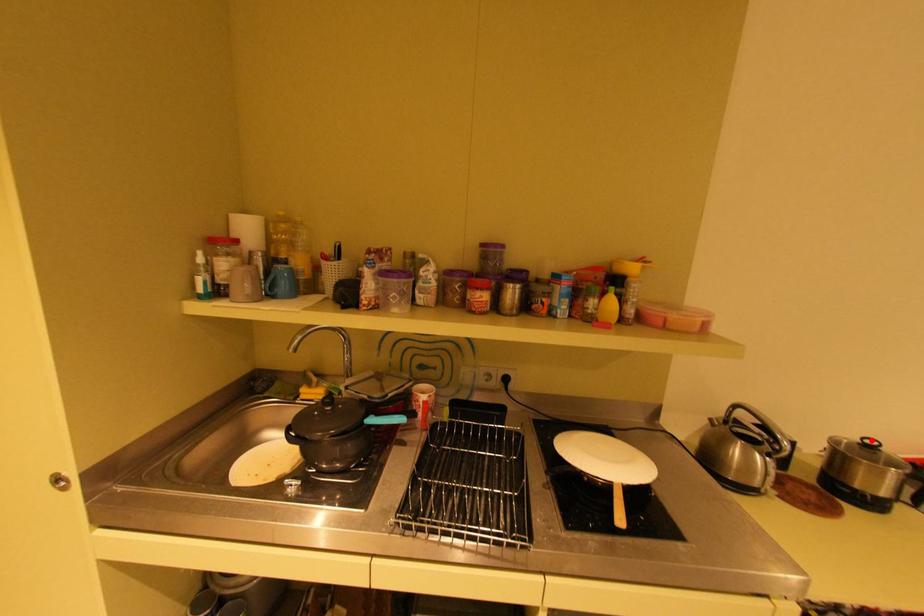
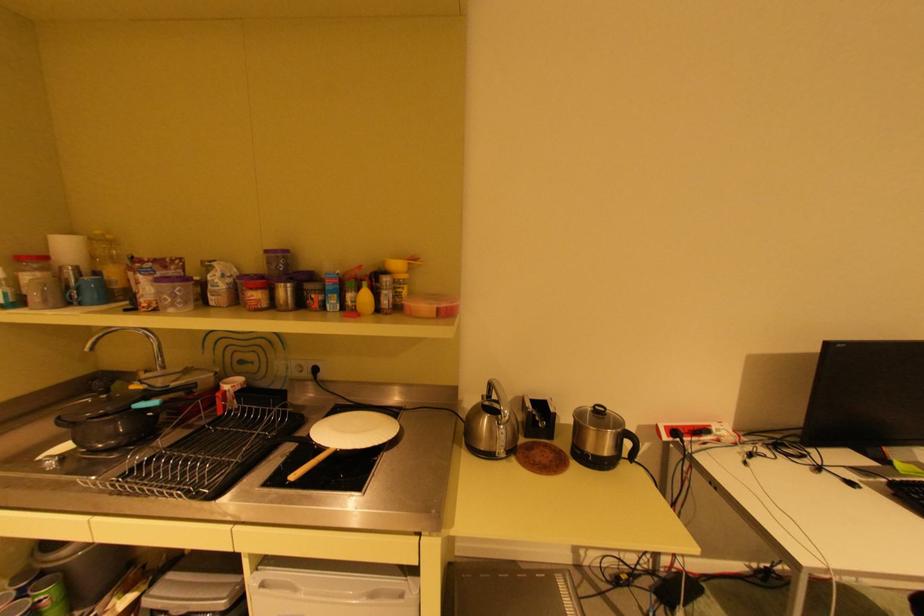
Question: I am providing you with two images of the same scene from different viewpoints. A red point is marked on the first image. Is the red point's position out of view in image 2?

Choices:
 (A) Yes
 (B) No

Answer: (B)